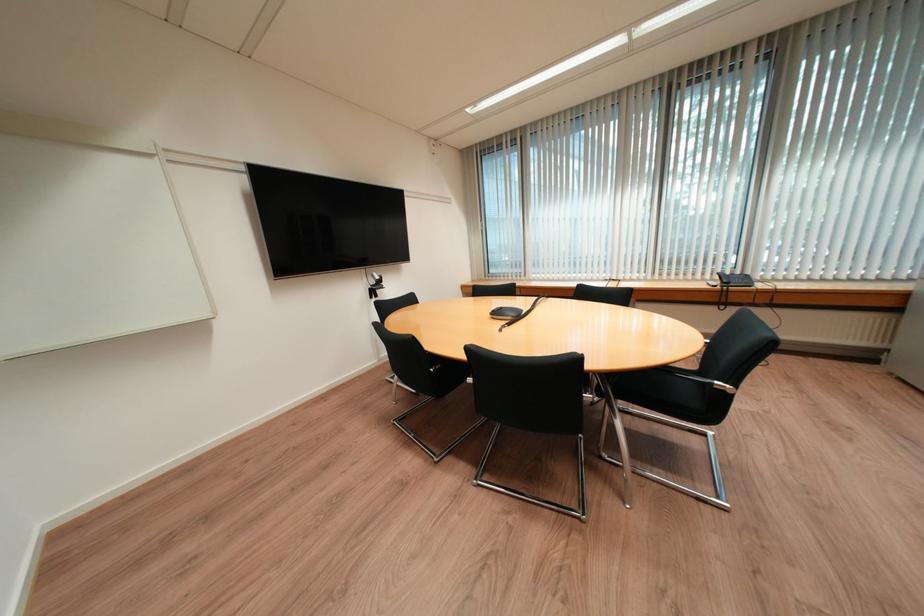
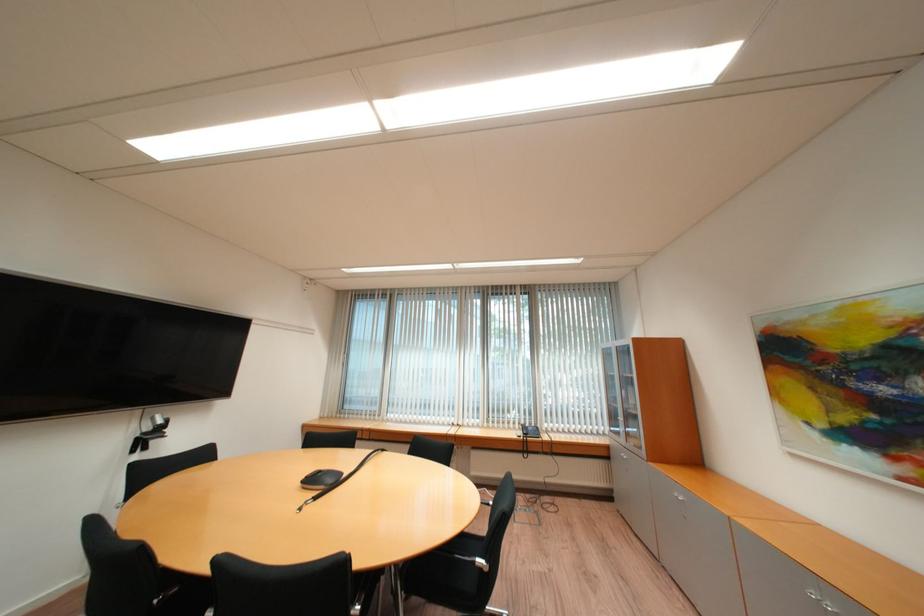
In the second image, find the point that corresponds to [505,315] in the first image.

(320, 482)